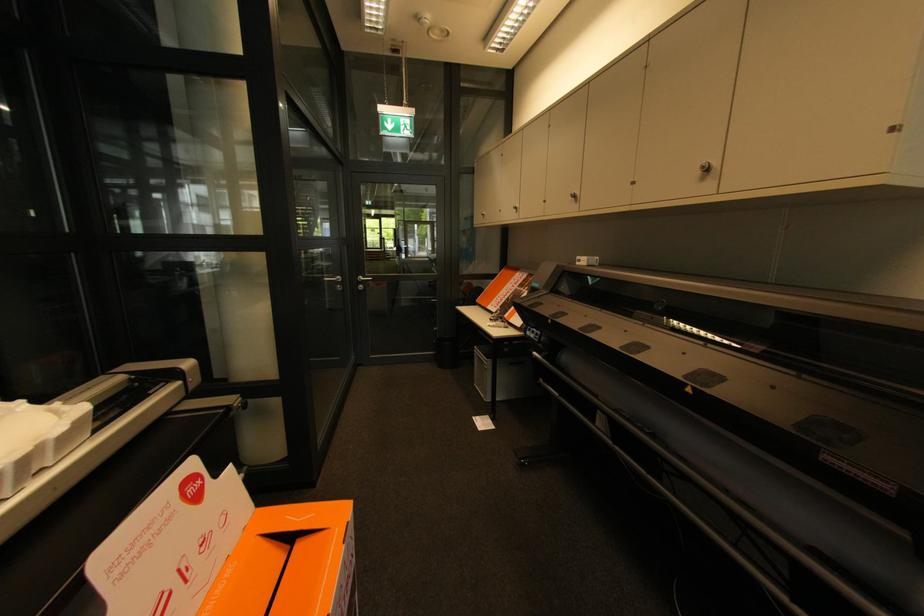
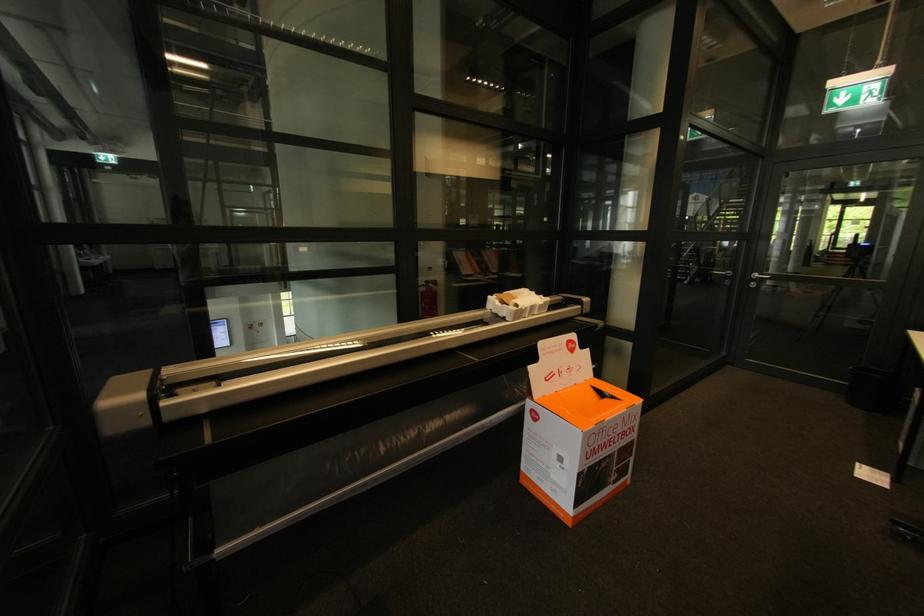
Question: The images are taken continuously from a first-person perspective. In which direction is your viewpoint rotating?

Choices:
 (A) Left
 (B) Right
 (C) Up
 (D) Down

Answer: (A)